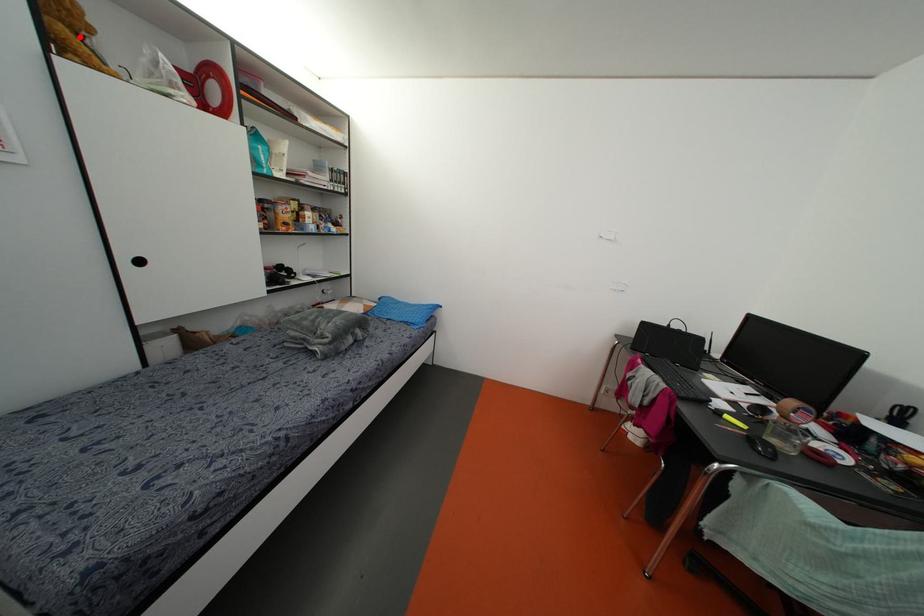
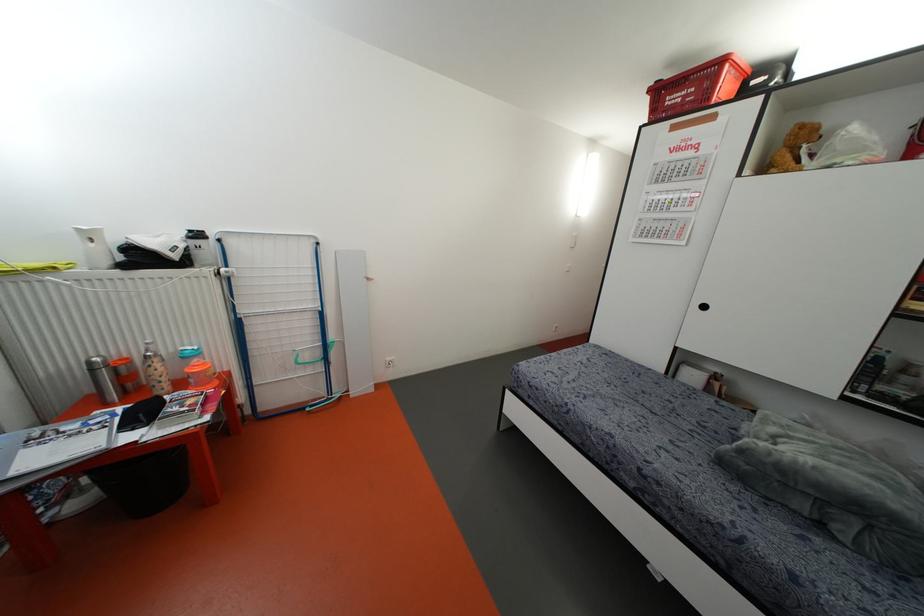
Where in the second image is the point corresponding to the highlighted location from the first image?

(796, 150)